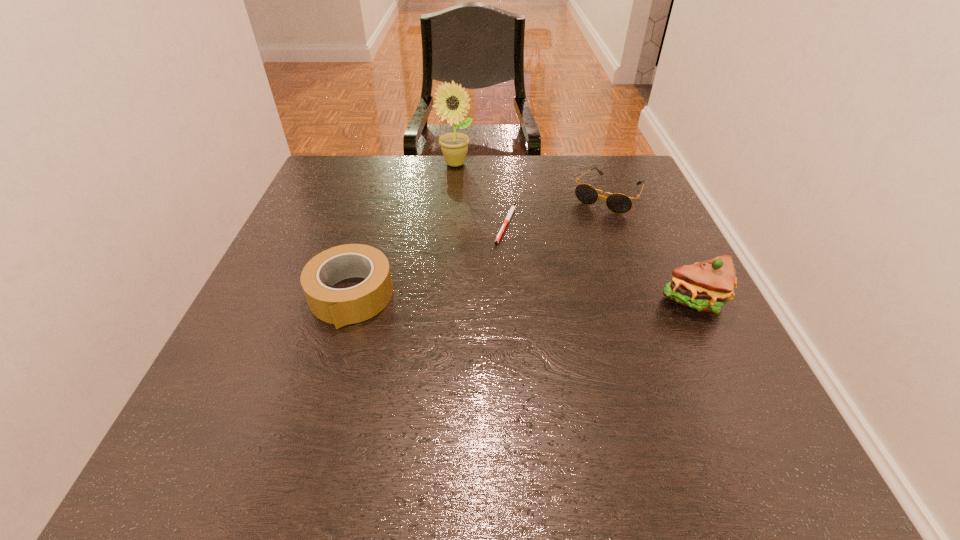
Where is `vacant space on the desktop that is between the duct tape and the sandwich and is positioned on the front-facing side of the sunglasses`? The height and width of the screenshot is (540, 960). vacant space on the desktop that is between the duct tape and the sandwich and is positioned on the front-facing side of the sunglasses is located at coordinates (538, 299).

You are a GUI agent. You are given a task and a screenshot of the screen. Output one action in this format:
    pyautogui.click(x=<x>, y=<y>)
    Task: Click on the free space on the desktop that is between the duct tape and the sandwich and is positioned on the face of the sunflower
    This screenshot has height=540, width=960.
    Given the screenshot: What is the action you would take?
    pyautogui.click(x=532, y=299)

Find the location of a particular element. The height and width of the screenshot is (540, 960). vacant space on the desktop that is between the duct tape and the sandwich and is positioned on the clicker of the shortest object is located at coordinates click(540, 299).